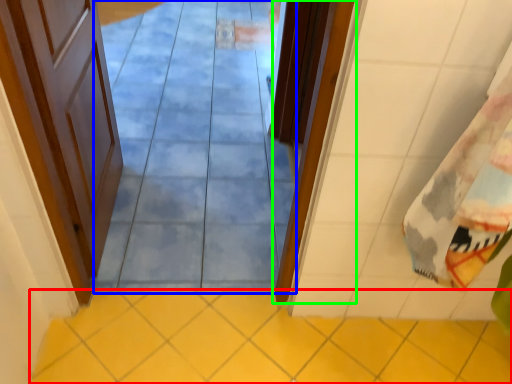
Question: Which object is the farthest from ceramic tile (highlighted by a red box)? Choose among these: path (highlighted by a blue box) or door (highlighted by a green box).

Choices:
 (A) path
 (B) door

Answer: (A)